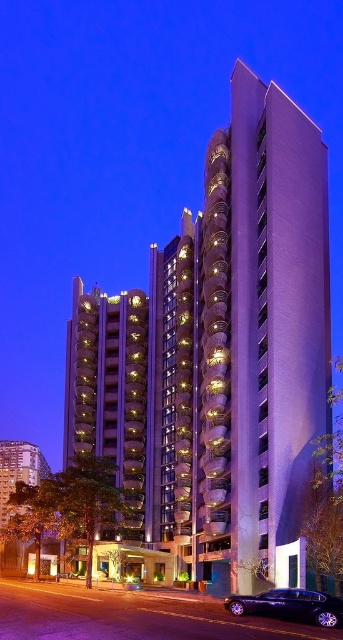
Consider the image. Is purple smooth building at center positioned in front of shiny black sedan at lower right?

No.

I want to click on purple smooth building at center, so click(x=263, y=326).

Where is `purple smooth building at center`? purple smooth building at center is located at coordinates (263, 326).